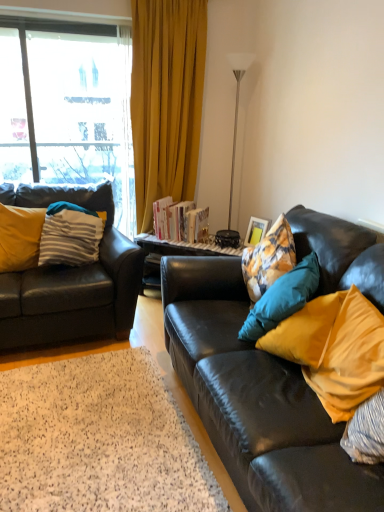
The height and width of the screenshot is (512, 384). In order to click on striped fabric pillow at left, which is the 4th pillow from front to back in this screenshot , I will do `click(70, 236)`.

Image resolution: width=384 pixels, height=512 pixels. Identify the location of hardcover books at center. (180, 221).

Find the location of a particular element. The width and height of the screenshot is (384, 512). yellow fabric pillow at left, which ranks as the 2th pillow in back-to-front order is located at coordinates (20, 237).

Where is `silver metallic floor lamp at upper right`? Image resolution: width=384 pixels, height=512 pixels. silver metallic floor lamp at upper right is located at coordinates tap(234, 145).

At what (x,y) coordinates should I click in order to perform the action: click on matte yellow pillow at right, which appears as the 3th pillow when viewed from the left. Please return your answer as a coordinate pair (x, y). The height and width of the screenshot is (512, 384). Looking at the image, I should click on (282, 298).

Are clear glass window at left and matte black leather couch at left, acting as the 2th studio couch starting from the right, far apart?

No, there isn't a large distance between clear glass window at left and matte black leather couch at left, acting as the 2th studio couch starting from the right.

From the image's perspective, would you say clear glass window at left is shown under matte black leather couch at left, acting as the 2th studio couch starting from the right?

No.

From a real-world perspective, is clear glass window at left physically above matte black leather couch at left, acting as the first studio couch starting from the left?

Indeed, from a real-world perspective, clear glass window at left stands above matte black leather couch at left, acting as the first studio couch starting from the left.

Is clear glass window at left behind matte black leather couch at left, acting as the first studio couch starting from the left?

Yes, it is.

From a real-world perspective, between matte yellow pillow at right, which appears as the 3th pillow when viewed from the left, and black leather couch at right, acting as the 2th studio couch starting from the left, who is vertically higher?

matte yellow pillow at right, which appears as the 3th pillow when viewed from the left.

From a real-world perspective, count 2nd studio couchs downward from the matte yellow pillow at right, marked as the third pillow in a back-to-front arrangement, and point to it. Please provide its 2D coordinates.

[(256, 399)]

From the image's perspective, does matte yellow pillow at right, the 2th pillow when ordered from right to left, appear higher than black leather couch at right, acting as the 2th studio couch starting from the left?

Yes, from the image's perspective, matte yellow pillow at right, the 2th pillow when ordered from right to left, is over black leather couch at right, acting as the 2th studio couch starting from the left.

Who is bigger, yellow fabric pillow at left, which ranks as the 2th pillow in back-to-front order, or clear glass window at left?

Bigger between the two is clear glass window at left.

Looking at this image, does yellow fabric pillow at left, marked as the 3th pillow in a front-to-back arrangement, have a lesser height compared to clear glass window at left?

Indeed, yellow fabric pillow at left, marked as the 3th pillow in a front-to-back arrangement, has a lesser height compared to clear glass window at left.

Is yellow fabric pillow at left, which is the first pillow from left to right, not inside clear glass window at left?

Indeed, yellow fabric pillow at left, which is the first pillow from left to right, is completely outside clear glass window at left.

Is point (173, 117) closer to viewer compared to point (381, 321)?

No, (173, 117) is further to viewer.

Based on the photo, between yellow fabric curtain at left and matte yellow pillow at right, arranged as the 1th pillow when viewed from the front, which one has smaller width?

matte yellow pillow at right, arranged as the 1th pillow when viewed from the front.

Can you confirm if yellow fabric curtain at left is positioned to the right of matte yellow pillow at right, the first pillow positioned from the right?

No.

Is matte yellow pillow at right, the first pillow positioned from the right, surrounded by yellow fabric curtain at left?

That's incorrect, matte yellow pillow at right, the first pillow positioned from the right, is not inside yellow fabric curtain at left.

Does yellow fabric pillow at left, which ranks as the 2th pillow in back-to-front order, have a lesser width compared to matte yellow pillow at right, the 2th pillow in the front-to-back sequence?

Correct, the width of yellow fabric pillow at left, which ranks as the 2th pillow in back-to-front order, is less than that of matte yellow pillow at right, the 2th pillow in the front-to-back sequence.

How many degrees apart are the facing directions of yellow fabric pillow at left, which is the first pillow from left to right, and matte yellow pillow at right, marked as the third pillow in a back-to-front arrangement?

The angular difference between yellow fabric pillow at left, which is the first pillow from left to right, and matte yellow pillow at right, marked as the third pillow in a back-to-front arrangement, is 120 degrees.

In the image, is yellow fabric pillow at left, marked as the fourth pillow in a right-to-left arrangement, on the left side or the right side of matte yellow pillow at right, the 2th pillow when ordered from right to left?

Based on their positions, yellow fabric pillow at left, marked as the fourth pillow in a right-to-left arrangement, is located to the left of matte yellow pillow at right, the 2th pillow when ordered from right to left.

Is yellow fabric pillow at left, which is the first pillow from left to right, completely or partially outside of matte yellow pillow at right, which appears as the 3th pillow when viewed from the left?

Yes, yellow fabric pillow at left, which is the first pillow from left to right, is not within matte yellow pillow at right, which appears as the 3th pillow when viewed from the left.

You are a GUI agent. You are given a task and a screenshot of the screen. Output one action in this format:
    pyautogui.click(x=<x>, y=<y>)
    Task: Click on the picture frame on the right of yellow fabric pillow at left, marked as the fourth pillow in a right-to-left arrangement
    The height and width of the screenshot is (512, 384).
    Given the screenshot: What is the action you would take?
    pyautogui.click(x=256, y=231)

In the scene shown: Is yellow fabric pillow at left, which is the first pillow from left to right, oriented away from matte wooden picture frame at right?

No, matte wooden picture frame at right is not at the back of yellow fabric pillow at left, which is the first pillow from left to right.

Can you confirm if yellow fabric pillow at left, which is the first pillow from left to right, is taller than matte wooden picture frame at right?

Yes.

From the image's perspective, who appears lower, black leather couch at right, the 1th studio couch viewed from the right, or hardcover books at center?

black leather couch at right, the 1th studio couch viewed from the right, from the image's perspective.

Is hardcover books at center completely or partially inside black leather couch at right, the 1th studio couch viewed from the right?

No, hardcover books at center is not surrounded by black leather couch at right, the 1th studio couch viewed from the right.

Based on the photo, how far apart are black leather couch at right, the 1th studio couch viewed from the right, and hardcover books at center?

A distance of 1.23 meters exists between black leather couch at right, the 1th studio couch viewed from the right, and hardcover books at center.

Is black leather couch at right, acting as the 2th studio couch starting from the left, touching hardcover books at center?

No, black leather couch at right, acting as the 2th studio couch starting from the left, is not in contact with hardcover books at center.

From the image's perspective, starting from the clear glass window at left, which studio couch is the 1st one below? Please provide its 2D coordinates.

[(72, 282)]

Which pillow is the 2nd one when counting from the back of the black leather couch at right, the 1th studio couch viewed from the right? Please provide its 2D coordinates.

[(282, 298)]

Which object lies further to the anchor point matte wooden picture frame at right, hardcover books at center or black leather couch at right, acting as the 2th studio couch starting from the left?

black leather couch at right, acting as the 2th studio couch starting from the left.

Looking at the image, which one is located further to yellow fabric curtain at left, striped fabric pillow at left, which is the first pillow in back-to-front order, or clear glass window at left?

Based on the image, striped fabric pillow at left, which is the first pillow in back-to-front order, appears to be further to yellow fabric curtain at left.

Looking at the image, which one is located closer to matte yellow pillow at right, which ranks as the fourth pillow in left-to-right order, matte wooden picture frame at right or yellow fabric pillow at left, marked as the fourth pillow in a right-to-left arrangement?

matte wooden picture frame at right lies closer to matte yellow pillow at right, which ranks as the fourth pillow in left-to-right order, than the other object.

From the picture: Which object lies nearer to the anchor point silver metallic floor lamp at upper right, black leather couch at right, the 1th studio couch viewed from the right, or yellow fabric curtain at left?

yellow fabric curtain at left is closer to silver metallic floor lamp at upper right.

Which object lies nearer to the anchor point matte black leather couch at left, acting as the 2th studio couch starting from the right, yellow fabric curtain at left or matte wooden picture frame at right?

The object closer to matte black leather couch at left, acting as the 2th studio couch starting from the right, is yellow fabric curtain at left.

When comparing their distances from matte wooden picture frame at right, does clear glass window at left or yellow fabric curtain at left seem further?

Among the two, clear glass window at left is located further to matte wooden picture frame at right.

Based on their spatial positions, is matte wooden picture frame at right or matte yellow pillow at right, which ranks as the 4th pillow in back-to-front order, closer to silver metallic floor lamp at upper right?

Among the two, matte wooden picture frame at right is located nearer to silver metallic floor lamp at upper right.

When comparing their distances from yellow fabric pillow at left, which is the first pillow from left to right, does matte yellow pillow at right, the first pillow positioned from the right, or hardcover books at center seem closer?

Among the two, hardcover books at center is located nearer to yellow fabric pillow at left, which is the first pillow from left to right.

Where is `flat between black leather couch at right, acting as the 2th studio couch starting from the left, and yellow fabric pillow at left, marked as the fourth pillow in a right-to-left arrangement, from front to back`? The image size is (384, 512). flat between black leather couch at right, acting as the 2th studio couch starting from the left, and yellow fabric pillow at left, marked as the fourth pillow in a right-to-left arrangement, from front to back is located at coordinates pos(99,439).

This screenshot has width=384, height=512. Identify the location of curtain between black leather couch at right, acting as the 2th studio couch starting from the left, and silver metallic floor lamp at upper right in the front-back direction. (166, 100).

Locate an element on the screen. Image resolution: width=384 pixels, height=512 pixels. curtain between clear glass window at left and matte yellow pillow at right, the 2th pillow when ordered from right to left, in the horizontal direction is located at coordinates point(166,100).

This screenshot has height=512, width=384. Find the location of `curtain between clear glass window at left and white shag rug at lower left vertically`. curtain between clear glass window at left and white shag rug at lower left vertically is located at coordinates (166, 100).